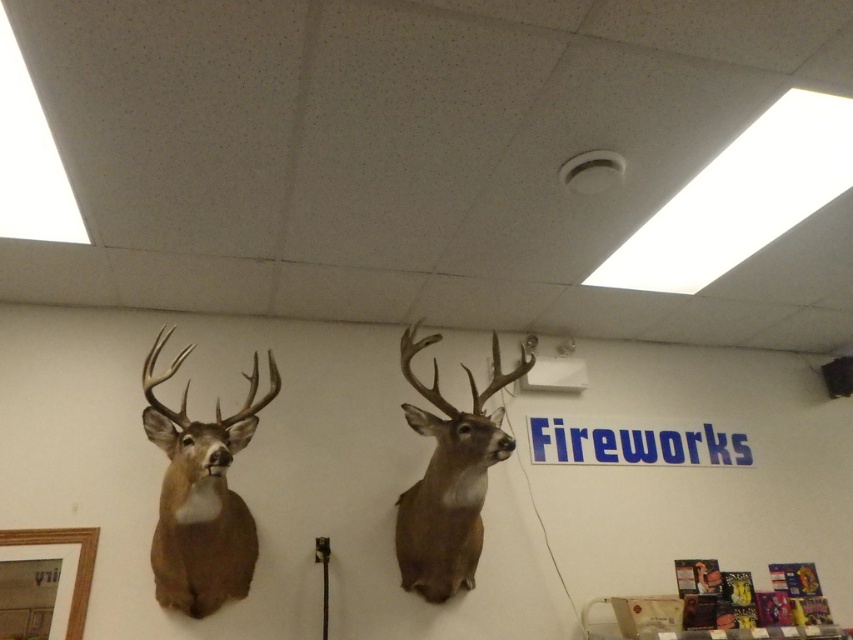
Between brown matte/deer head at left and brown matte/deer head at center, which one has more height?

brown matte/deer head at center

Describe the element at coordinates (200, 496) in the screenshot. Image resolution: width=853 pixels, height=640 pixels. I see `brown matte/deer head at left` at that location.

This screenshot has width=853, height=640. Find the location of `brown matte/deer head at left`. brown matte/deer head at left is located at coordinates (200, 496).